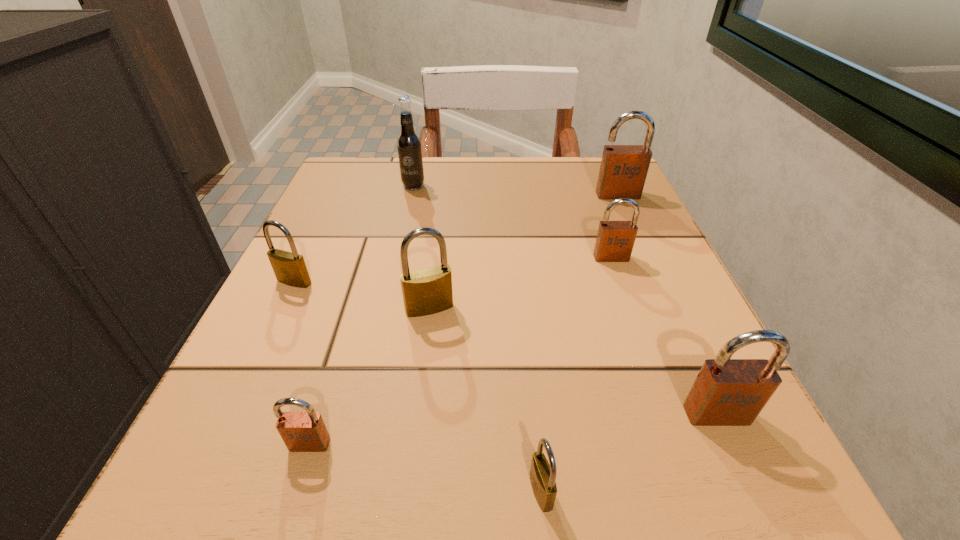
Find the location of a particular element. Image resolution: width=960 pixels, height=540 pixels. root beer is located at coordinates (409, 145).

Where is `the tallest padlock`? the tallest padlock is located at coordinates (623, 170).

Image resolution: width=960 pixels, height=540 pixels. Find the location of `the farthest padlock`. the farthest padlock is located at coordinates (623, 170).

Image resolution: width=960 pixels, height=540 pixels. Identify the location of the biggest brass padlock. (428, 291).

This screenshot has height=540, width=960. Find the location of `the fourth nearest padlock`. the fourth nearest padlock is located at coordinates (428, 291).

Where is `the second biggest brown padlock`? The height and width of the screenshot is (540, 960). the second biggest brown padlock is located at coordinates (727, 392).

The width and height of the screenshot is (960, 540). In order to click on the second nearest brown padlock in this screenshot , I will do point(727,392).

Where is `the leftmost brass padlock`? the leftmost brass padlock is located at coordinates (289, 268).

Where is `the fourth farthest object`? The image size is (960, 540). the fourth farthest object is located at coordinates (289, 268).

The image size is (960, 540). I want to click on the sixth nearest padlock, so click(x=615, y=240).